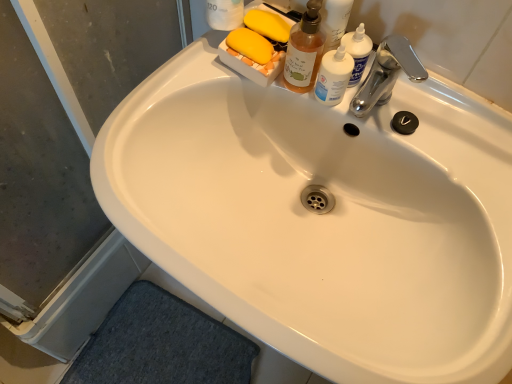
This screenshot has width=512, height=384. What are the coordinates of `vacant area that lies to the right of translucent amber liquid soap dispenser at upper center` in the screenshot? It's located at (433, 127).